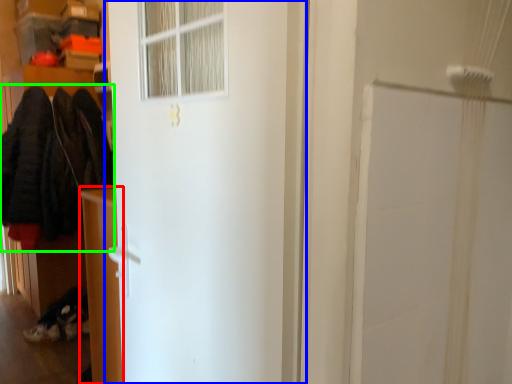
Question: Which object is positioned closest to furniture (highlighted by a red box)? Select from door (highlighted by a blue box) and clothing (highlighted by a green box).

Choices:
 (A) door
 (B) clothing

Answer: (A)